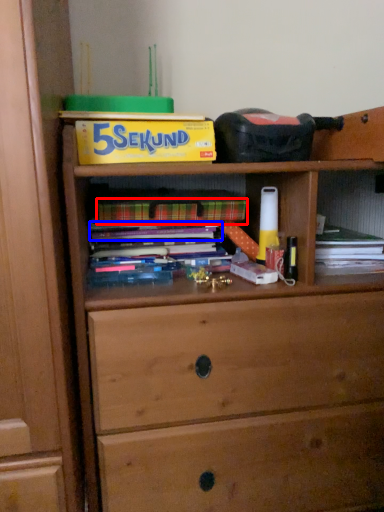
Question: Which of the following is the farthest to the observer, paperback book (highlighted by a red box) or book (highlighted by a blue box)?

Choices:
 (A) paperback book
 (B) book

Answer: (B)